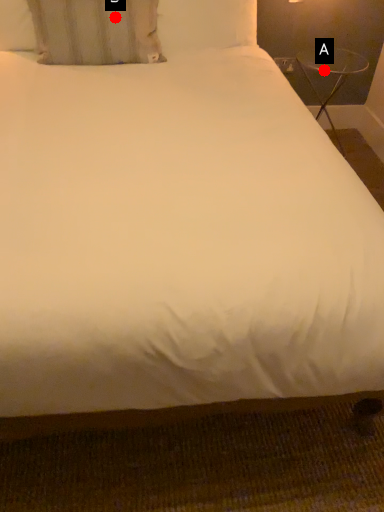
Question: Two points are circled on the image, labeled by A and B beside each circle. Which point appears farthest from the camera in this image?

Choices:
 (A) A is further
 (B) B is further

Answer: (A)